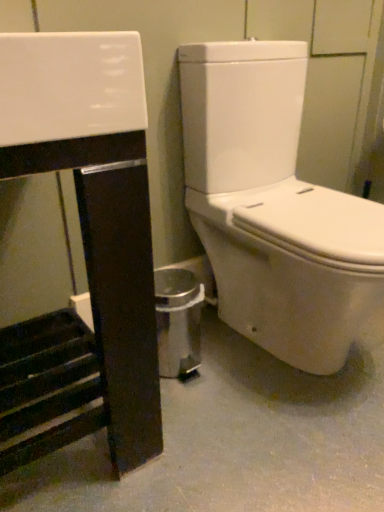
At what (x,y) coordinates should I click in order to perform the action: click on glossy black vanity at left. Please return your answer as a coordinate pair (x, y). Looking at the image, I should click on (93, 219).

What do you see at coordinates (93, 219) in the screenshot? The width and height of the screenshot is (384, 512). I see `glossy black vanity at left` at bounding box center [93, 219].

I want to click on glossy black vanity at left, so click(x=93, y=219).